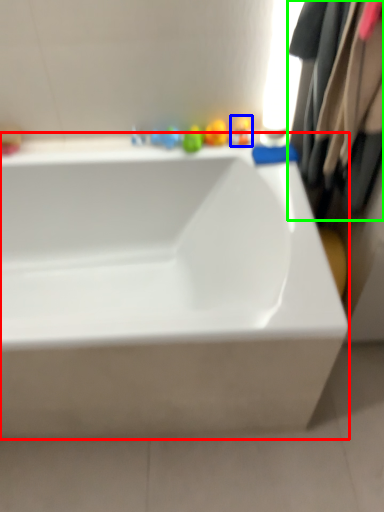
Question: Which object is the closest to the bathtub (highlighted by a red box)? Choose among these: toy (highlighted by a blue box) or clothing (highlighted by a green box).

Choices:
 (A) toy
 (B) clothing

Answer: (B)